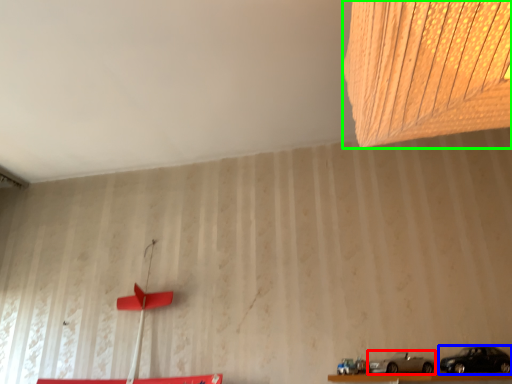
Question: Based on their relative distances, which object is farther from car (highlighted by a red box)? Choose from car (highlighted by a blue box) and lamp (highlighted by a green box).

Choices:
 (A) car
 (B) lamp

Answer: (B)